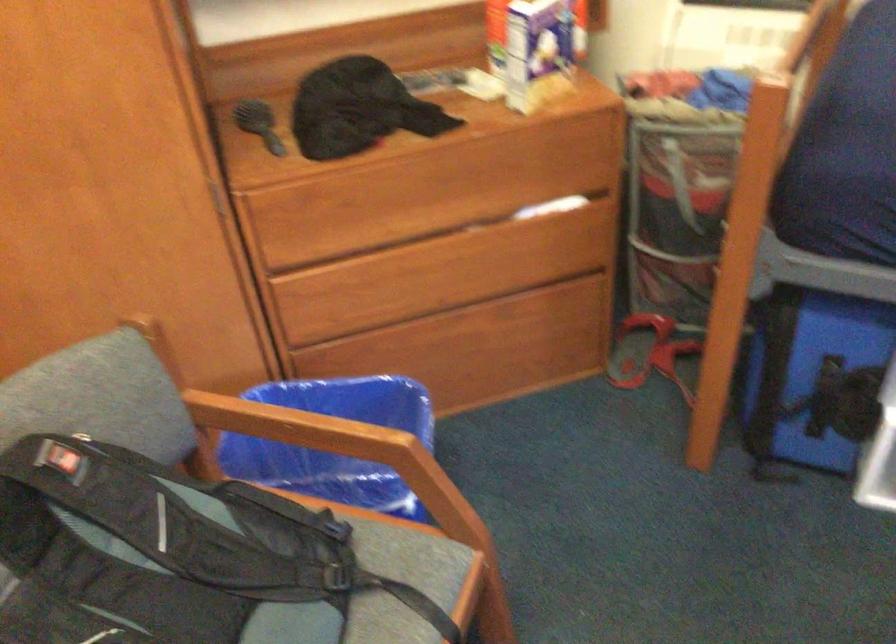
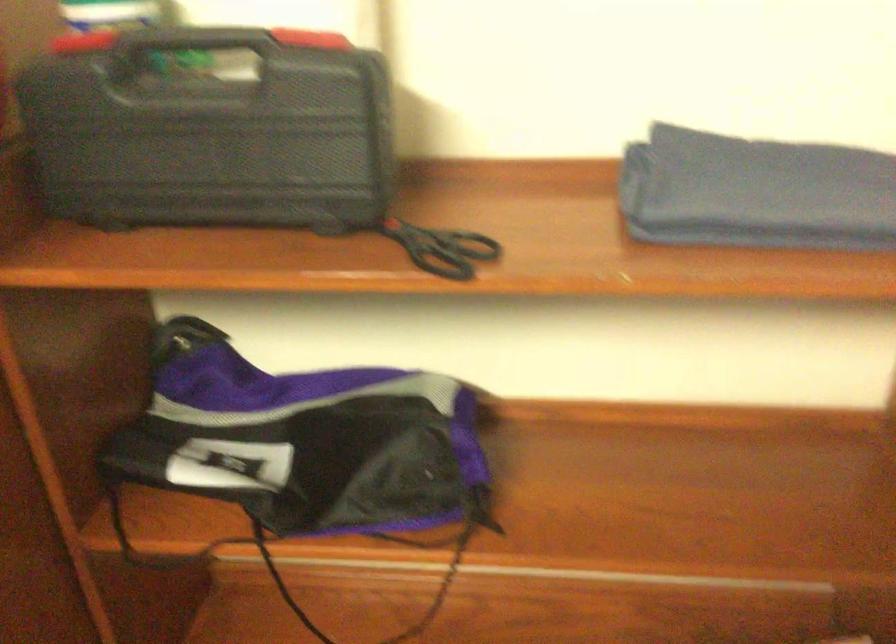
Question: What movement of the cameraman would produce the second image?

Choices:
 (A) Left
 (B) Right
 (C) Forward
 (D) Backward

Answer: (C)